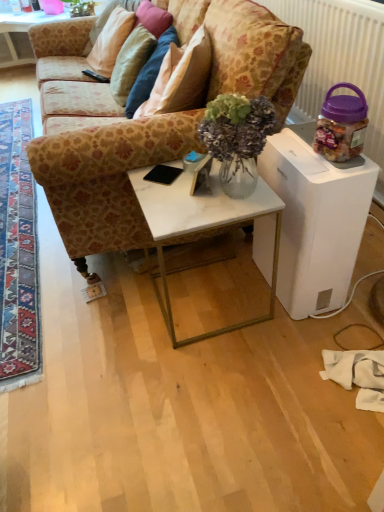
Locate an element on the screen. This screenshot has width=384, height=512. free space to the left of translucent glass vase at center is located at coordinates (176, 207).